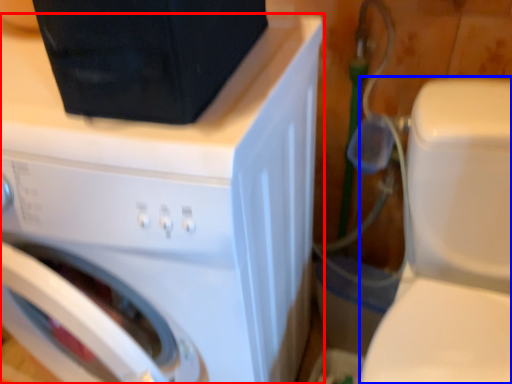
Question: Which object appears farthest to the camera in this image, washing machine (highlighted by a red box) or washer (highlighted by a blue box)?

Choices:
 (A) washing machine
 (B) washer

Answer: (A)